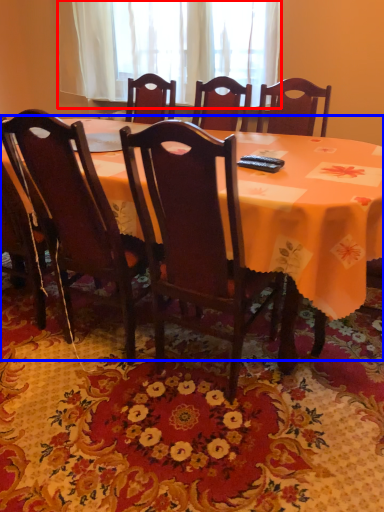
Question: Which of the following is the closest to the observer, curtain (highlighted by a red box) or table (highlighted by a blue box)?

Choices:
 (A) curtain
 (B) table

Answer: (B)